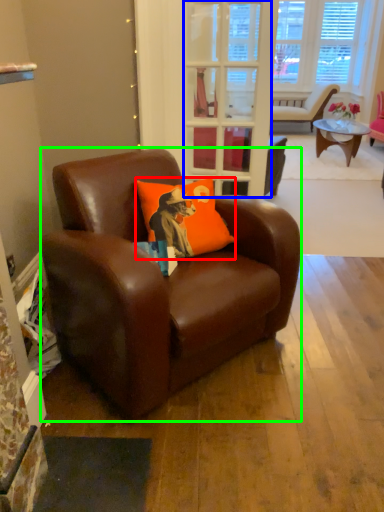
Question: Which object is the farthest from pillow (highlighted by a red box)? Choose among these: glass door (highlighted by a blue box) or chair (highlighted by a green box).

Choices:
 (A) glass door
 (B) chair

Answer: (A)